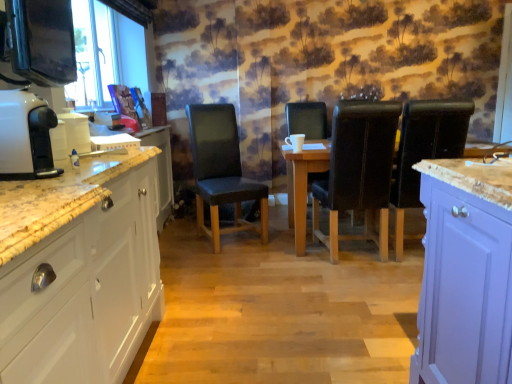
Image resolution: width=512 pixels, height=384 pixels. I want to click on free space in front of leather-like black chair at center-left, the first chair from the left, so click(240, 261).